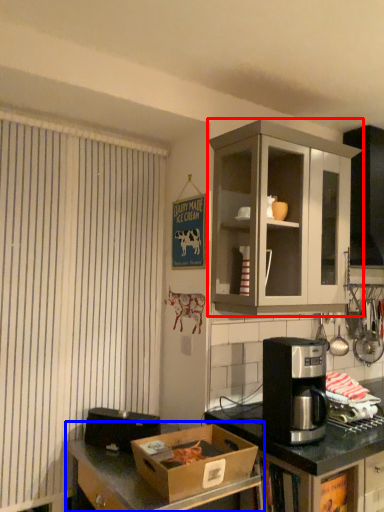
Question: Which of the following is the closest to the observer, cabinetry (highlighted by a red box) or desk (highlighted by a blue box)?

Choices:
 (A) cabinetry
 (B) desk

Answer: (B)